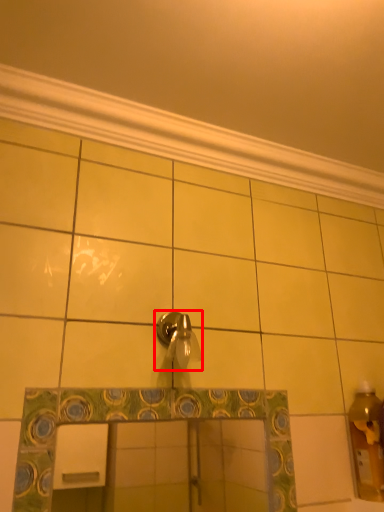
Question: From the image's perspective, where is tap (annotated by the red box) located in relation to molding in the image?

Choices:
 (A) below
 (B) above

Answer: (A)